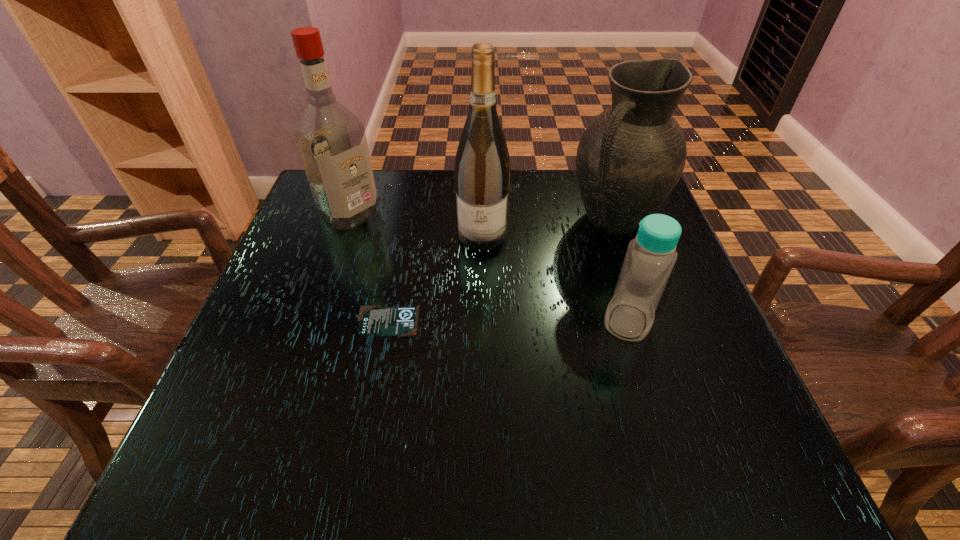
Find the location of a particular element. object situated at the left edge is located at coordinates (331, 140).

At what (x,y) coordinates should I click in order to perform the action: click on bottle located in the right edge section of the desktop. Please return your answer as a coordinate pair (x, y). Looking at the image, I should click on (650, 257).

I want to click on pitcher present at the right edge, so click(x=631, y=156).

Identify the location of object present at the far left corner. This screenshot has width=960, height=540. (331, 140).

Find the location of a particular element. This screenshot has height=540, width=960. object situated at the far right corner is located at coordinates (631, 156).

I want to click on blank area at the far edge, so click(x=541, y=220).

Identify the location of vacant space at the near edge of the desktop. (515, 398).

In the image, there is a desktop. Where is `free space at the left edge`? The image size is (960, 540). free space at the left edge is located at coordinates (292, 255).

The image size is (960, 540). In the image, there is a desktop. Identify the location of free space at the right edge. (606, 244).

The width and height of the screenshot is (960, 540). In order to click on free space at the near right corner of the desktop in this screenshot , I will do `click(672, 416)`.